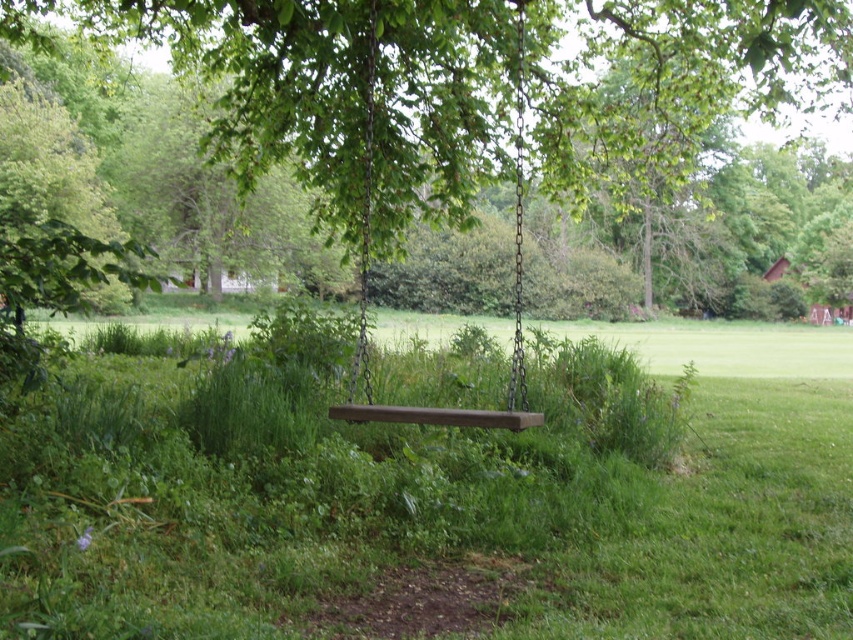
Who is lower down, green grassy at center or brown wooden swing at center?

green grassy at center is below.

Can you confirm if green grassy at center is positioned below brown wooden swing at center?

Yes, green grassy at center is below brown wooden swing at center.

Is point (276, 456) less distant than point (527, 404)?

Yes, point (276, 456) is in front of point (527, 404).

The image size is (853, 640). I want to click on green grassy at center, so click(x=434, y=502).

Which is below, green grassy at center or green wood swing at center?

green grassy at center is below.

Who is positioned more to the left, green grassy at center or green wood swing at center?

green wood swing at center is more to the left.

This screenshot has width=853, height=640. Identify the location of green grassy at center. (434, 502).

The image size is (853, 640). Identify the location of green grassy at center. (434, 502).

Is green wood swing at center positioned at the back of brown wooden swing at center?

No.

Can you confirm if green wood swing at center is shorter than brown wooden swing at center?

No, green wood swing at center is not shorter than brown wooden swing at center.

Between point (236, 93) and point (369, 147), which one is positioned in front?

Positioned in front is point (369, 147).

Locate an element on the screen. The width and height of the screenshot is (853, 640). green wood swing at center is located at coordinates (463, 90).